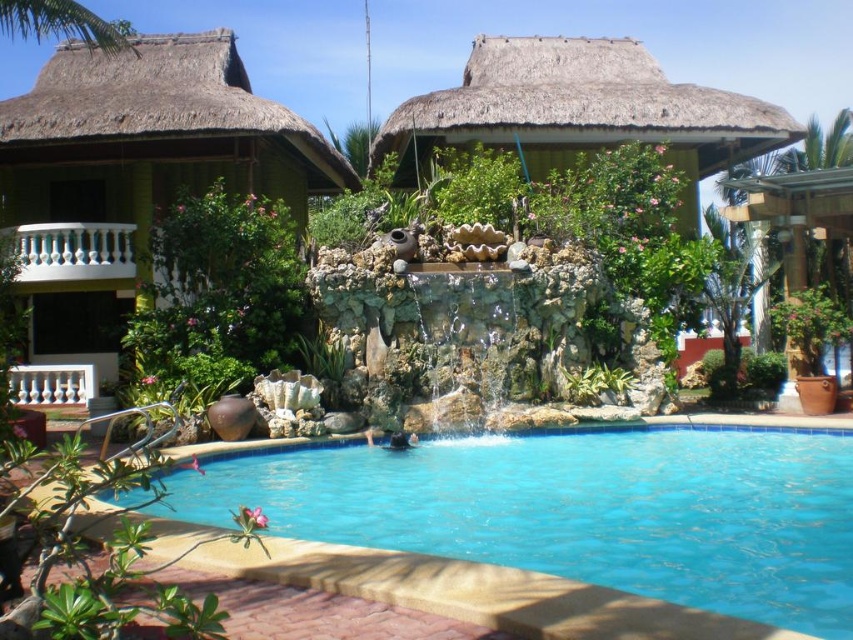
Is green thatched roof hut at left bigger than natural thatched roof hut at center?

No.

What do you see at coordinates (135, 173) in the screenshot?
I see `green thatched roof hut at left` at bounding box center [135, 173].

The height and width of the screenshot is (640, 853). Find the location of `green thatched roof hut at left`. green thatched roof hut at left is located at coordinates pos(135,173).

Which is more to the left, blue tile swimming pool at center or green thatched roof hut at left?

green thatched roof hut at left

Does blue tile swimming pool at center have a smaller size compared to green thatched roof hut at left?

Yes, blue tile swimming pool at center is smaller than green thatched roof hut at left.

Which is in front, point (833, 458) or point (148, 38)?

Positioned in front is point (833, 458).

In order to click on blue tile swimming pool at center in this screenshot , I will do pos(581,509).

Is point (219, 522) closer to viewer compared to point (660, 129)?

Yes, it is in front of point (660, 129).

Is blue tile swimming pool at center taller than natural thatched roof hut at center?

In fact, blue tile swimming pool at center may be shorter than natural thatched roof hut at center.

Does point (489, 458) come behind point (793, 132)?

No, it is in front of (793, 132).

Where is `blue tile swimming pool at center`? Image resolution: width=853 pixels, height=640 pixels. blue tile swimming pool at center is located at coordinates (581, 509).